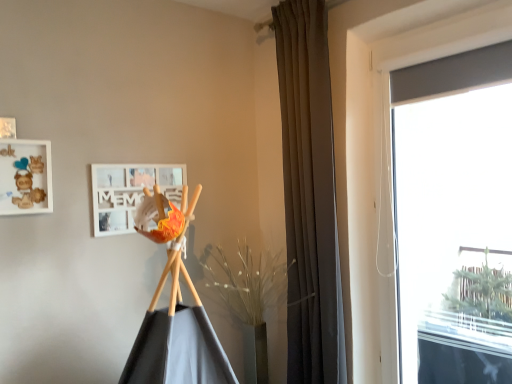
Question: Is the surface of transparent glass window at right in direct contact with white matte picture frame at upper center, the second picture frame from the left?

Choices:
 (A) no
 (B) yes

Answer: (A)

Question: Is transparent glass window at right to the right of white matte picture frame at upper center, positioned as the first picture frame in back-to-front order, from the viewer's perspective?

Choices:
 (A) yes
 (B) no

Answer: (A)

Question: Is transparent glass window at right not close to white matte picture frame at upper center, the first picture frame positioned from the right?

Choices:
 (A) no
 (B) yes

Answer: (B)

Question: Can you confirm if transparent glass window at right is bigger than white matte picture frame at upper center, the first picture frame positioned from the right?

Choices:
 (A) yes
 (B) no

Answer: (A)

Question: Considering the relative positions of transparent glass window at right and white matte picture frame at upper center, the first picture frame positioned from the right, in the image provided, is transparent glass window at right to the left of white matte picture frame at upper center, the first picture frame positioned from the right, from the viewer's perspective?

Choices:
 (A) no
 (B) yes

Answer: (A)

Question: In terms of width, does wooden frame at upper left, acting as the first picture frame starting from the front, look wider or thinner when compared to brown fabric curtain at center?

Choices:
 (A) wide
 (B) thin

Answer: (B)

Question: Relative to brown fabric curtain at center, is wooden frame at upper left, acting as the first picture frame starting from the front, in front or behind?

Choices:
 (A) front
 (B) behind

Answer: (A)

Question: From a real-world perspective, is wooden frame at upper left, which is the 1th picture frame from left to right, positioned above or below brown fabric curtain at center?

Choices:
 (A) above
 (B) below

Answer: (A)

Question: From the image's perspective, is wooden frame at upper left, which is the 1th picture frame from left to right, above or below brown fabric curtain at center?

Choices:
 (A) below
 (B) above

Answer: (B)

Question: Based on their positions, is white matte picture frame at upper center, the second picture frame from the left, located to the left or right of brown fabric curtain at center?

Choices:
 (A) left
 (B) right

Answer: (A)

Question: From a real-world perspective, is white matte picture frame at upper center, the second picture frame from the left, positioned above or below brown fabric curtain at center?

Choices:
 (A) above
 (B) below

Answer: (A)

Question: In terms of width, does white matte picture frame at upper center, the second picture frame from the left, look wider or thinner when compared to brown fabric curtain at center?

Choices:
 (A) thin
 (B) wide

Answer: (A)

Question: From the image's perspective, relative to brown fabric curtain at center, is white matte picture frame at upper center, positioned as the first picture frame in back-to-front order, above or below?

Choices:
 (A) above
 (B) below

Answer: (A)

Question: From the image's perspective, is brown fabric curtain at center above or below transparent glass window at right?

Choices:
 (A) below
 (B) above

Answer: (B)

Question: From their relative heights in the image, would you say brown fabric curtain at center is taller or shorter than transparent glass window at right?

Choices:
 (A) short
 (B) tall

Answer: (B)